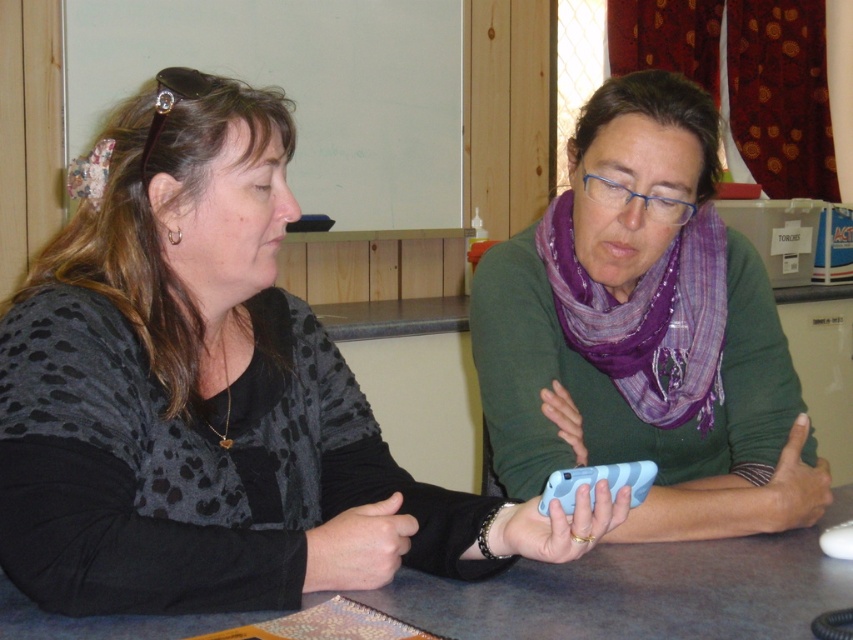
Based on the photo, you are an observer in the room. You see the matte black sweater at center and the purple scarf at center. Which one is positioned to the left?

The matte black sweater at center is positioned to the left of the purple scarf at center.

Looking at this image, you are a fashion designer observing the scene. You need to determine which item of clothing is bigger between the matte black sweater at center and the purple scarf at center. Which one is larger?

The matte black sweater at center is larger in size than the purple scarf at center.

You are a social distancing monitor in a classroom. You observe two people sitting at a table, one wearing a purple scarf at center and the other holding a smartphone. Are they maintaining a safe distance of 1.2 meters apart?

The two individuals are 1.11 meters apart, which is less than the required 1.2 meters for safe distancing. They are not maintaining a safe distance.